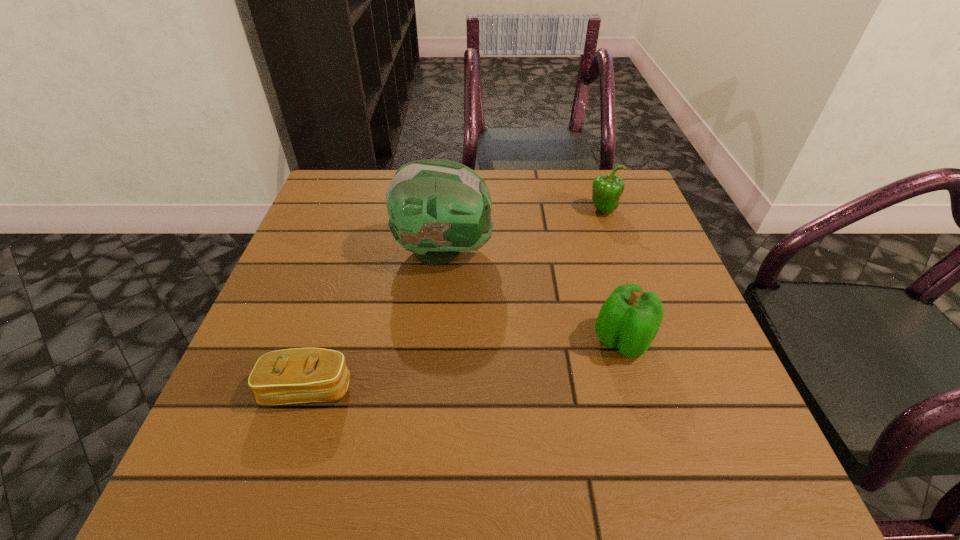
Identify the location of vacant area between the farthest object and the nearest object. The width and height of the screenshot is (960, 540). (455, 300).

Select which object is the closest to the farthest object. Please provide its 2D coordinates. Your answer should be formatted as a tuple, i.e. [(x, y)], where the tuple contains the x and y coordinates of a point satisfying the conditions above.

[(437, 208)]

Identify which object is located as the nearest to the farthest object. Please provide its 2D coordinates. Your answer should be formatted as a tuple, i.e. [(x, y)], where the tuple contains the x and y coordinates of a point satisfying the conditions above.

[(437, 208)]

The height and width of the screenshot is (540, 960). What are the coordinates of `free location that satisfies the following two spatial constraints: 1. on the visor of the tallest object; 2. on the zipper side of the leftmost object` in the screenshot? It's located at (432, 389).

The width and height of the screenshot is (960, 540). Find the location of `vacant region that satisfies the following two spatial constraints: 1. on the back side of the farther bell pepper; 2. on the left side of the second nearest object`. vacant region that satisfies the following two spatial constraints: 1. on the back side of the farther bell pepper; 2. on the left side of the second nearest object is located at coordinates (585, 210).

At what (x,y) coordinates should I click in order to perform the action: click on free spot that satisfies the following two spatial constraints: 1. on the back side of the farther bell pepper; 2. on the right side of the second nearest object. Please return your answer as a coordinate pair (x, y). The image size is (960, 540). Looking at the image, I should click on (585, 210).

Image resolution: width=960 pixels, height=540 pixels. I want to click on free space that satisfies the following two spatial constraints: 1. on the back side of the second nearest object; 2. on the visor of the football helmet, so click(x=596, y=251).

Identify the location of free space that satisfies the following two spatial constraints: 1. on the visor of the second object from left to right; 2. on the zipper side of the clutch bag. This screenshot has height=540, width=960. (432, 389).